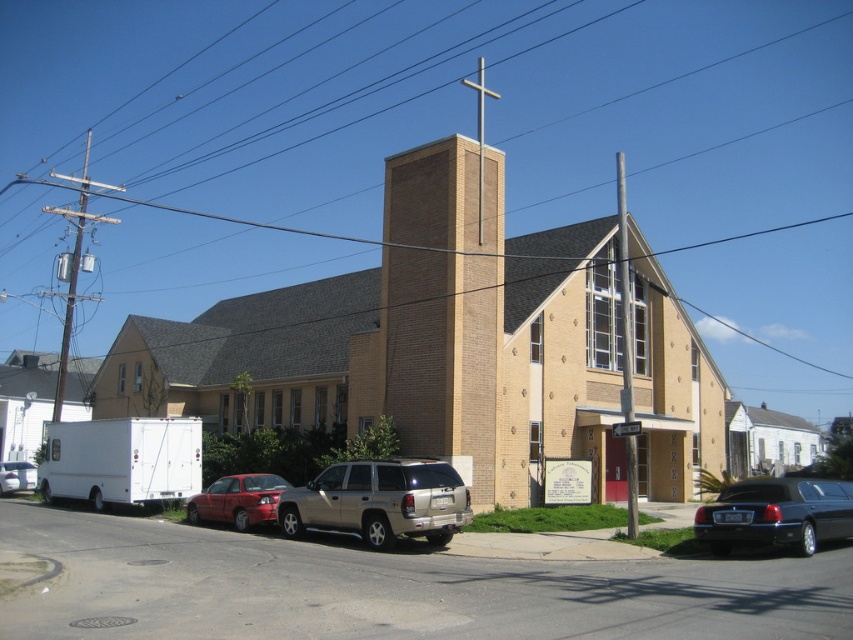
Question: Does brown brick church at center have a smaller size compared to silver metallic suv at center?

Choices:
 (A) no
 (B) yes

Answer: (A)

Question: Which object is closer to the camera taking this photo?

Choices:
 (A) brown brick church at center
 (B) shiny black limousine at lower right

Answer: (B)

Question: Can you confirm if silver metallic suv at center is wider than shiny red sedan at lower left?

Choices:
 (A) yes
 (B) no

Answer: (A)

Question: Which of the following is the farthest from the observer?

Choices:
 (A) (477, 499)
 (B) (4, 484)
 (C) (309, 522)
 (D) (4, 492)

Answer: (D)

Question: Considering the real-world distances, which object is closest to the matte white van at left?

Choices:
 (A) shiny black limousine at lower right
 (B) shiny red sedan at lower left

Answer: (B)

Question: Can you confirm if silver metallic suv at center is wider than shiny black limousine at lower right?

Choices:
 (A) yes
 (B) no

Answer: (B)